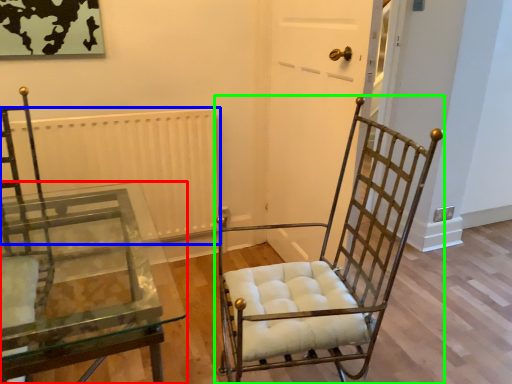
Question: Which object is positioned closest to table (highlighted by a red box)? Select from radiator (highlighted by a blue box) and chair (highlighted by a green box).

Choices:
 (A) radiator
 (B) chair

Answer: (A)